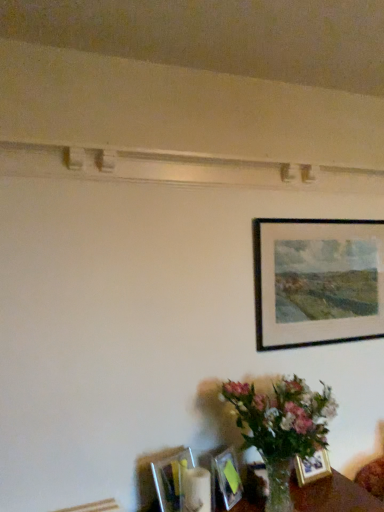
Question: From the image's perspective, is metallic silver picture frame at lower center, acting as the 1th picture frame starting from the left, above or below gold metallic picture frame at lower right, acting as the second picture frame starting from the right?

Choices:
 (A) below
 (B) above

Answer: (B)

Question: Looking at the image, does metallic silver picture frame at lower center, acting as the 1th picture frame starting from the left, seem bigger or smaller compared to gold metallic picture frame at lower right, the third picture frame positioned from the left?

Choices:
 (A) small
 (B) big

Answer: (B)

Question: Considering the real-world distances, which object is farthest from the black matte picture frame at upper right, placed as the 4th picture frame when sorted from left to right?

Choices:
 (A) matte glass picture frame at lower center, the 3th picture frame in the top-to-bottom sequence
 (B) metallic silver picture frame at lower center, acting as the 1th picture frame starting from the left
 (C) gold metallic picture frame at lower right, the third picture frame positioned from the left

Answer: (B)

Question: Estimate the real-world distances between objects in this image. Which object is farther from the black matte picture frame at upper right, which ranks as the 4th picture frame in bottom-to-top order?

Choices:
 (A) metallic silver picture frame at lower center, acting as the 1th picture frame starting from the left
 (B) matte glass picture frame at lower center, the second picture frame in the left-to-right sequence
 (C) gold metallic picture frame at lower right, the third picture frame positioned from the left

Answer: (A)